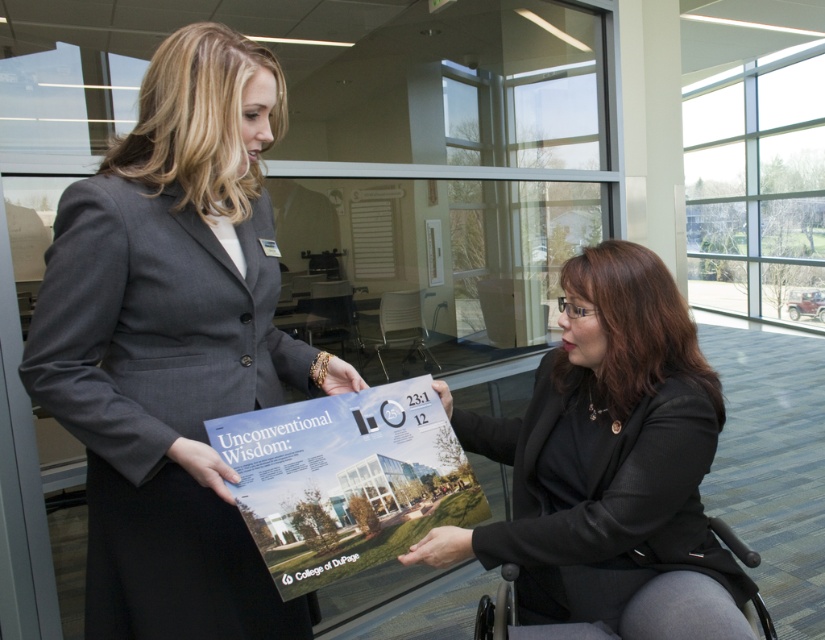
You are a photographer positioned at the camera. You want to capture a closeup shot of the matte gray blazer at center without moving the camera. Is it possible to do so with your current lens that has a minimum focusing distance of 1 meter?

The matte gray blazer at center is 1.02 meters away from camera, so yes, you can capture a closeup shot since the distance is slightly more than the lens minimum focusing distance of 1 meter.

From the picture: You are designing a new office layout and need to ensure there is enough space between the matte gray blazer at center and the black plastic wheelchair at lower right for a wheelchair to pass through. According to the scene description, what is the minimum width required for the path between them?

The matte gray blazer at center is wider than the black plastic wheelchair at lower right. To ensure wheelchair accessibility, the path between them should be at least 90 cm wide, which is the standard width required for a wheelchair to maneuver comfortably.

You are a photographer standing in front of the two women in the scene. You want to take a closeup shot of the brochure held by the woman on the left. Which of the two points, point (x=248, y=129) or point (x=478, y=636), is closer to you and would allow you to focus on the brochure?

Point (x=248, y=129) is closer to the viewer than point (x=478, y=636), so it would be the better point to focus on to capture the brochure held by the woman on the left.